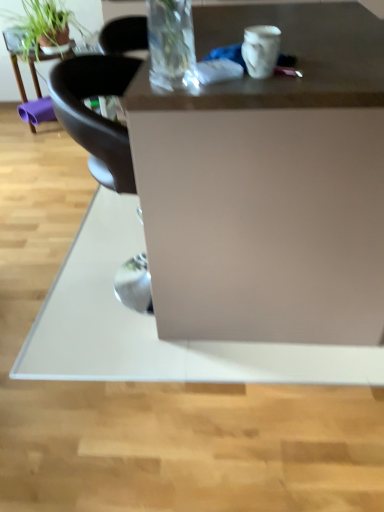
Question: Is point (18, 88) positioned closer to the camera than point (89, 23)?

Choices:
 (A) closer
 (B) farther

Answer: (B)

Question: From a real-world perspective, is matte black table at upper left above or below green matte plant at upper left?

Choices:
 (A) below
 (B) above

Answer: (A)

Question: Which of these objects is positioned closest to the matte white desk at center?

Choices:
 (A) matte black table at upper left
 (B) green matte plant at upper left

Answer: (B)

Question: Considering the real-world distances, which object is closest to the matte white desk at center?

Choices:
 (A) green matte plant at upper left
 (B) matte black table at upper left

Answer: (A)